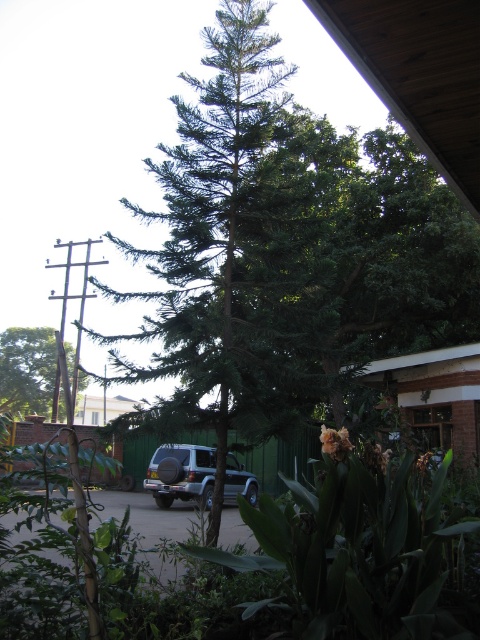
Question: Can you confirm if green matte tree at left is smaller than satin silver suv at center?

Choices:
 (A) yes
 (B) no

Answer: (B)

Question: Which point is closer to the camera taking this photo?

Choices:
 (A) (0, 348)
 (B) (190, 513)

Answer: (B)

Question: Among these points, which one is nearest to the camera?

Choices:
 (A) (49, 356)
 (B) (120, 513)
 (C) (212, 492)

Answer: (B)

Question: Which of the following is the closest to the observer?

Choices:
 (A) green matte tree at left
 (B) satin silver suv at center
 (C) gray metallic car at center

Answer: (C)

Question: Is gray metallic car at center above green matte tree at left?

Choices:
 (A) yes
 (B) no

Answer: (B)

Question: Is green matte tree at left below satin silver suv at center?

Choices:
 (A) yes
 (B) no

Answer: (B)